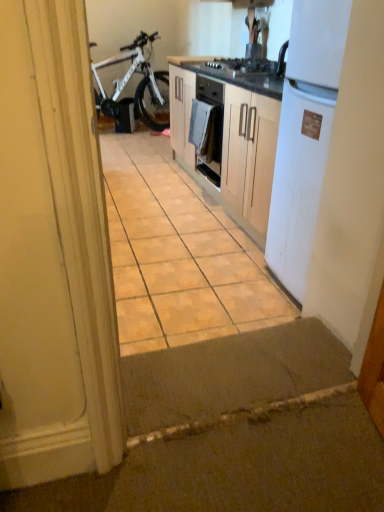
Question: Is brown matte tile at center located outside white cloth at center?

Choices:
 (A) yes
 (B) no

Answer: (A)

Question: From a real-world perspective, is brown matte tile at center positioned over white cloth at center based on gravity?

Choices:
 (A) no
 (B) yes

Answer: (A)

Question: Is brown matte tile at center beside white cloth at center?

Choices:
 (A) yes
 (B) no

Answer: (B)

Question: Does brown matte tile at center have a lesser height compared to white cloth at center?

Choices:
 (A) yes
 (B) no

Answer: (A)

Question: Is brown matte tile at center in front of white cloth at center?

Choices:
 (A) yes
 (B) no

Answer: (A)

Question: Would you say white cloth at center is inside or outside white matte refrigerator at right?

Choices:
 (A) inside
 (B) outside

Answer: (B)

Question: Visually, is white cloth at center positioned to the left or to the right of white matte refrigerator at right?

Choices:
 (A) left
 (B) right

Answer: (A)

Question: From their relative heights in the image, would you say white cloth at center is taller or shorter than white matte refrigerator at right?

Choices:
 (A) short
 (B) tall

Answer: (A)

Question: In terms of width, does white cloth at center look wider or thinner when compared to white matte refrigerator at right?

Choices:
 (A) wide
 (B) thin

Answer: (B)

Question: From a real-world perspective, is white matte bicycle at left physically located above or below white matte refrigerator at right?

Choices:
 (A) below
 (B) above

Answer: (A)

Question: From the image's perspective, is white matte bicycle at left above or below white matte refrigerator at right?

Choices:
 (A) above
 (B) below

Answer: (A)

Question: Is white matte bicycle at left in front of or behind white matte refrigerator at right in the image?

Choices:
 (A) behind
 (B) front

Answer: (A)

Question: Is white matte bicycle at left to the left or to the right of white matte refrigerator at right in the image?

Choices:
 (A) left
 (B) right

Answer: (A)

Question: In the image, is brown matte tile at center positioned in front of or behind white matte refrigerator at right?

Choices:
 (A) front
 (B) behind

Answer: (B)

Question: Would you say brown matte tile at center is inside or outside white matte refrigerator at right?

Choices:
 (A) outside
 (B) inside

Answer: (A)